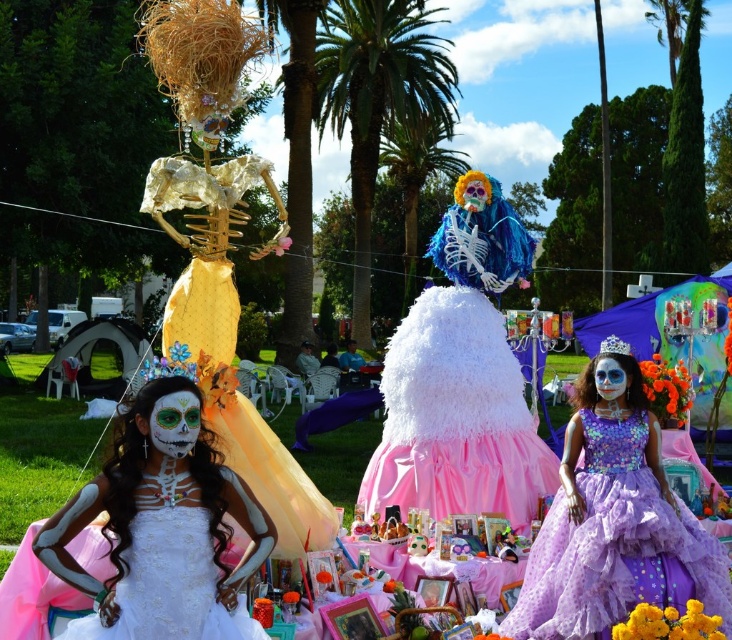
Who is lower down, white matte dress at center or lavender tulle dress at right?

lavender tulle dress at right is lower down.

Is white matte dress at center thinner than lavender tulle dress at right?

Yes, white matte dress at center is thinner than lavender tulle dress at right.

Where is `white matte dress at center`? white matte dress at center is located at coordinates (160, 528).

The image size is (732, 640). In order to click on white matte dress at center in this screenshot , I will do `click(160, 528)`.